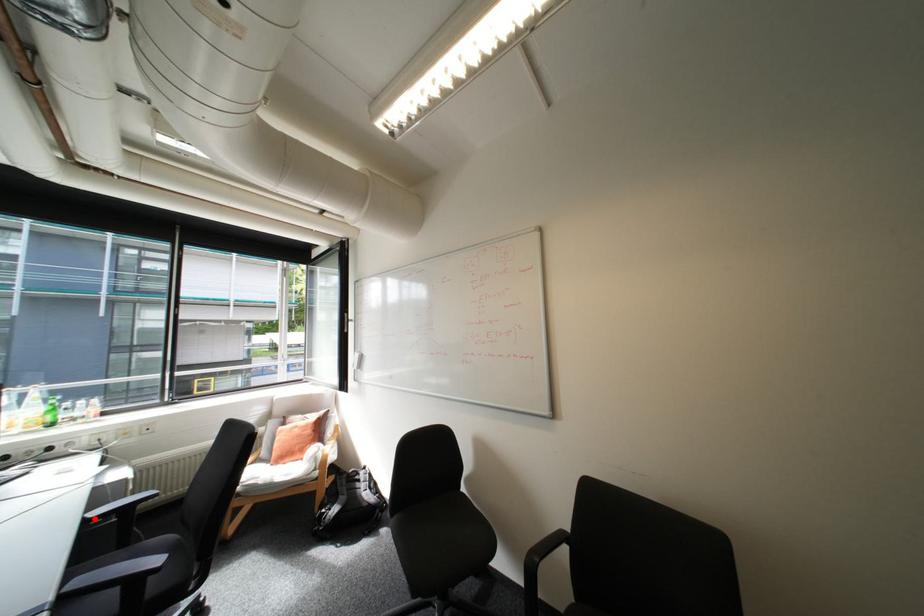
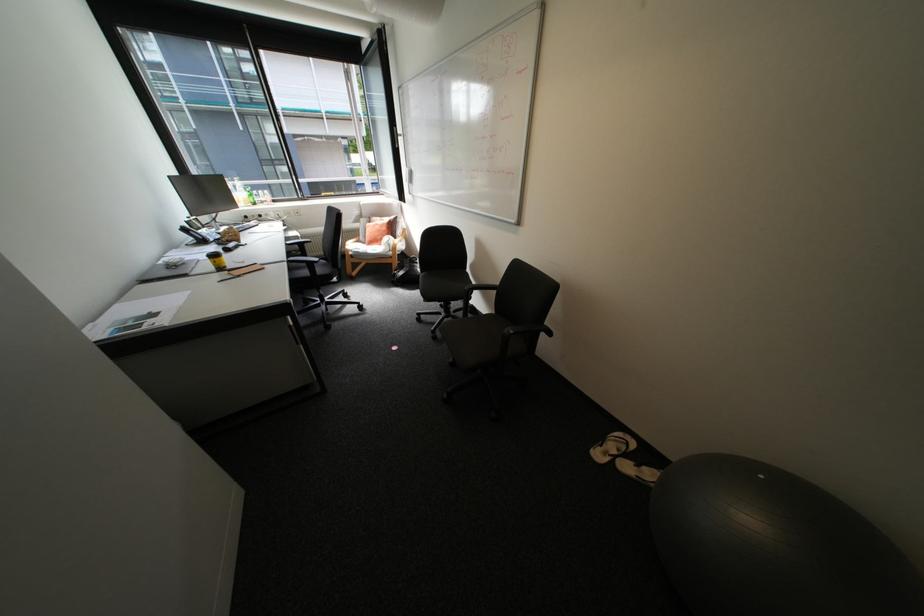
Question: I am providing you with two images of the same scene from different viewpoints. Given a red point in image1, look at the same physical point in image2. Is it:

Choices:
 (A) Closer to the viewpoint
 (B) Farther from the viewpoint

Answer: (A)